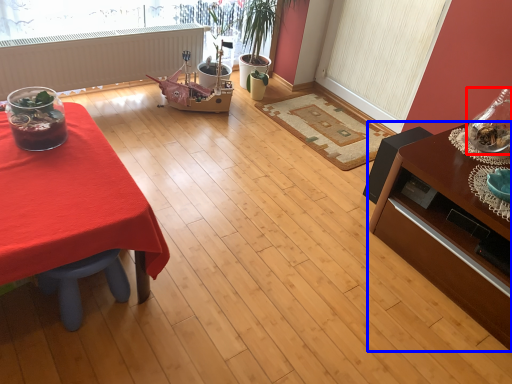
Question: Which object is closer to the camera taking this photo, glass vase (highlighted by a red box) or table (highlighted by a blue box)?

Choices:
 (A) glass vase
 (B) table

Answer: (B)